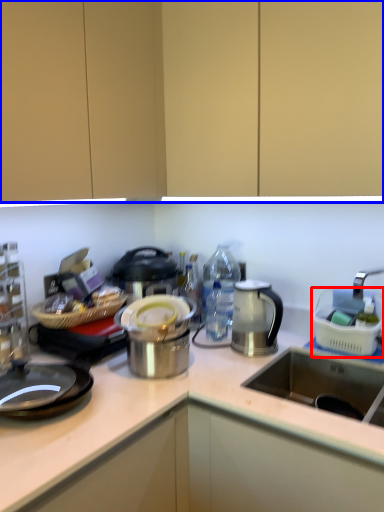
Question: Which object appears closest to the camera in this image, appliance (highlighted by a red box) or cabinetry (highlighted by a blue box)?

Choices:
 (A) appliance
 (B) cabinetry

Answer: (B)